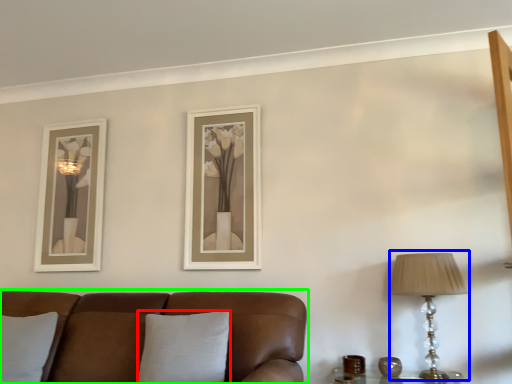
Question: Which is farther away from pillow (highlighted by a red box)? table lamp (highlighted by a blue box) or studio couch (highlighted by a green box)?

Choices:
 (A) table lamp
 (B) studio couch

Answer: (A)